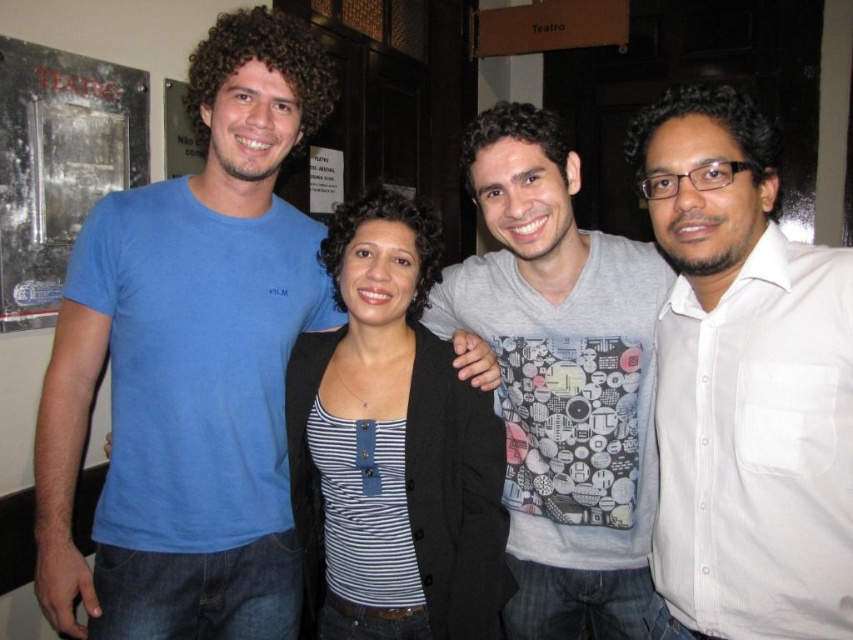
Between matte blue t-shirt at left and gray printed t-shirt at center, which one is positioned higher?

matte blue t-shirt at left

In the scene shown: Who is more distant from viewer, [97,604] or [641,292]?

The point [641,292] is more distant.

Find the location of a particular element. This screenshot has width=853, height=640. matte blue t-shirt at left is located at coordinates (190, 364).

Is matte blue t-shirt at left bigger than white shirt at right?

Yes.

Does matte blue t-shirt at left appear on the right side of white shirt at right?

In fact, matte blue t-shirt at left is to the left of white shirt at right.

The height and width of the screenshot is (640, 853). What are the coordinates of `matte blue t-shirt at left` in the screenshot? It's located at (190, 364).

Is gray printed t-shirt at center above striped fabric top at center?

Indeed, gray printed t-shirt at center is positioned over striped fabric top at center.

Between gray printed t-shirt at center and striped fabric top at center, which one appears on the right side from the viewer's perspective?

gray printed t-shirt at center is more to the right.

Is point (554, 385) positioned after point (366, 625)?

Yes, point (554, 385) is behind point (366, 625).

Where is `gray printed t-shirt at center`? This screenshot has height=640, width=853. gray printed t-shirt at center is located at coordinates (561, 380).